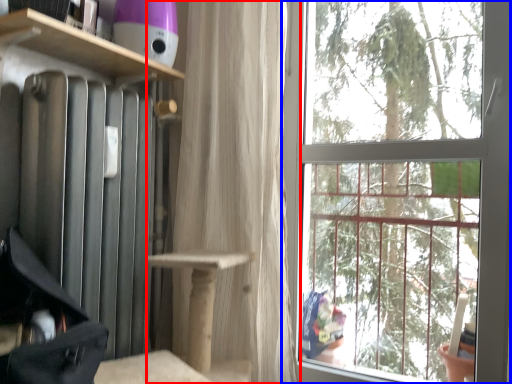
Question: Which of the following is the farthest to the observer, curtain (highlighted by a red box) or window (highlighted by a blue box)?

Choices:
 (A) curtain
 (B) window

Answer: (A)